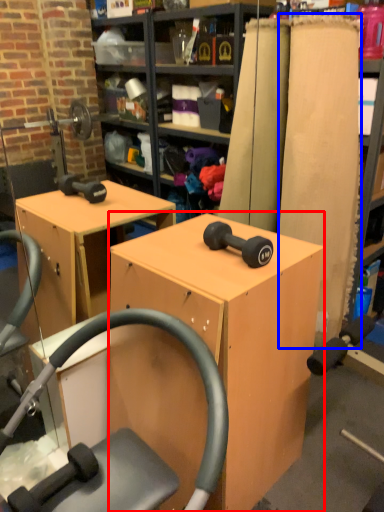
Question: Among these objects, which one is nearest to the camera, furniture (highlighted by a red box) or plank (highlighted by a blue box)?

Choices:
 (A) furniture
 (B) plank

Answer: (A)